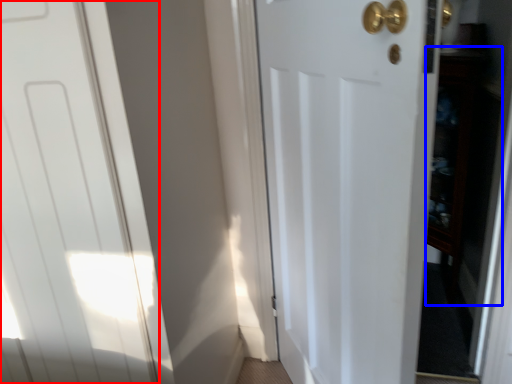
Question: Among these objects, which one is nearest to the camera, door (highlighted by a red box) or cabinetry (highlighted by a blue box)?

Choices:
 (A) door
 (B) cabinetry

Answer: (A)